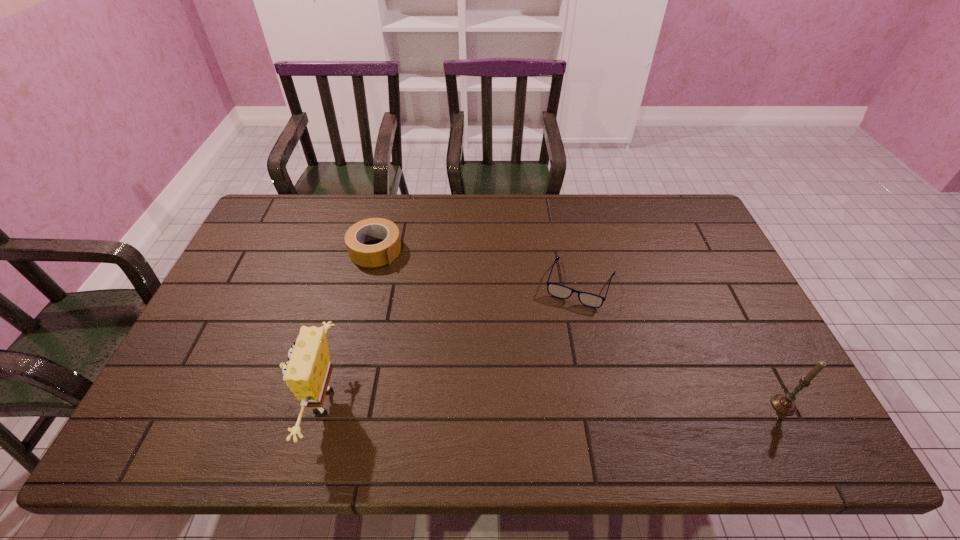
The image size is (960, 540). I want to click on free space in the image that satisfies the following two spatial constraints: 1. on the front side of the duct tape; 2. on the right side of the shortest object, so click(x=367, y=284).